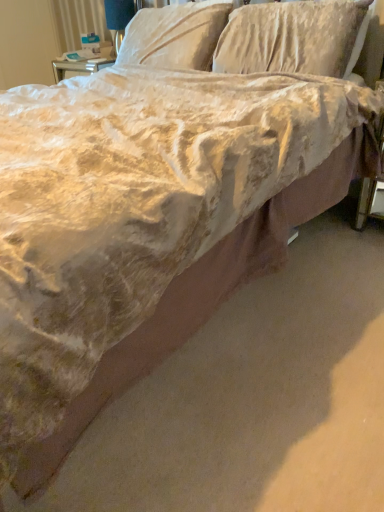
Question: Does velvet-like beige pillow at upper center, which is counted as the 1th pillow, starting from the left, lie behind velvet-like beige pillow at upper center, the second pillow positioned from the left?

Choices:
 (A) yes
 (B) no

Answer: (A)

Question: From the image's perspective, is velvet-like beige pillow at upper center, which is counted as the 1th pillow, starting from the left, over velvet-like beige pillow at upper center, the 1th pillow when ordered from right to left?

Choices:
 (A) no
 (B) yes

Answer: (B)

Question: Considering the relative sizes of velvet-like beige pillow at upper center, which is counted as the 1th pillow, starting from the left, and velvet-like beige pillow at upper center, the second pillow positioned from the left, in the image provided, is velvet-like beige pillow at upper center, which is counted as the 1th pillow, starting from the left, smaller than velvet-like beige pillow at upper center, the second pillow positioned from the left,?

Choices:
 (A) yes
 (B) no

Answer: (A)

Question: Is velvet-like beige pillow at upper center, which is counted as the 1th pillow, starting from the left, thinner than velvet-like beige pillow at upper center, the 1th pillow when ordered from right to left?

Choices:
 (A) yes
 (B) no

Answer: (B)

Question: From a real-world perspective, is velvet-like beige pillow at upper center, acting as the second pillow starting from the right, beneath velvet-like beige pillow at upper center, the second pillow positioned from the left?

Choices:
 (A) yes
 (B) no

Answer: (B)

Question: Do you think matte white table lamp at upper center is within velvet-like beige pillow at upper center, acting as the second pillow starting from the right, or outside of it?

Choices:
 (A) outside
 (B) inside

Answer: (A)

Question: From a real-world perspective, relative to velvet-like beige pillow at upper center, which is counted as the 1th pillow, starting from the left, is matte white table lamp at upper center vertically above or below?

Choices:
 (A) below
 (B) above

Answer: (A)

Question: Considering the positions of matte white table lamp at upper center and velvet-like beige pillow at upper center, acting as the second pillow starting from the right, in the image, is matte white table lamp at upper center taller or shorter than velvet-like beige pillow at upper center, acting as the second pillow starting from the right,?

Choices:
 (A) short
 (B) tall

Answer: (B)

Question: In the image, is matte white table lamp at upper center positioned in front of or behind velvet-like beige pillow at upper center, acting as the second pillow starting from the right?

Choices:
 (A) front
 (B) behind

Answer: (B)

Question: Considering the positions of matte white table lamp at upper center and velvet-like beige pillow at upper center, the 1th pillow when ordered from right to left, in the image, is matte white table lamp at upper center bigger or smaller than velvet-like beige pillow at upper center, the 1th pillow when ordered from right to left,?

Choices:
 (A) small
 (B) big

Answer: (A)

Question: In the image, is matte white table lamp at upper center positioned in front of or behind velvet-like beige pillow at upper center, the second pillow positioned from the left?

Choices:
 (A) front
 (B) behind

Answer: (B)

Question: From the image's perspective, is matte white table lamp at upper center above or below velvet-like beige pillow at upper center, the second pillow positioned from the left?

Choices:
 (A) below
 (B) above

Answer: (B)

Question: Choose the correct answer: Is matte white table lamp at upper center inside velvet-like beige pillow at upper center, the 1th pillow when ordered from right to left, or outside it?

Choices:
 (A) outside
 (B) inside

Answer: (A)

Question: From a real-world perspective, relative to velvet-like beige pillow at upper center, the 1th pillow when ordered from right to left, is velvet-like beige pillow at upper center, acting as the second pillow starting from the right, vertically above or below?

Choices:
 (A) below
 (B) above

Answer: (B)

Question: Based on their positions, is velvet-like beige pillow at upper center, acting as the second pillow starting from the right, located to the left or right of velvet-like beige pillow at upper center, the second pillow positioned from the left?

Choices:
 (A) left
 (B) right

Answer: (A)